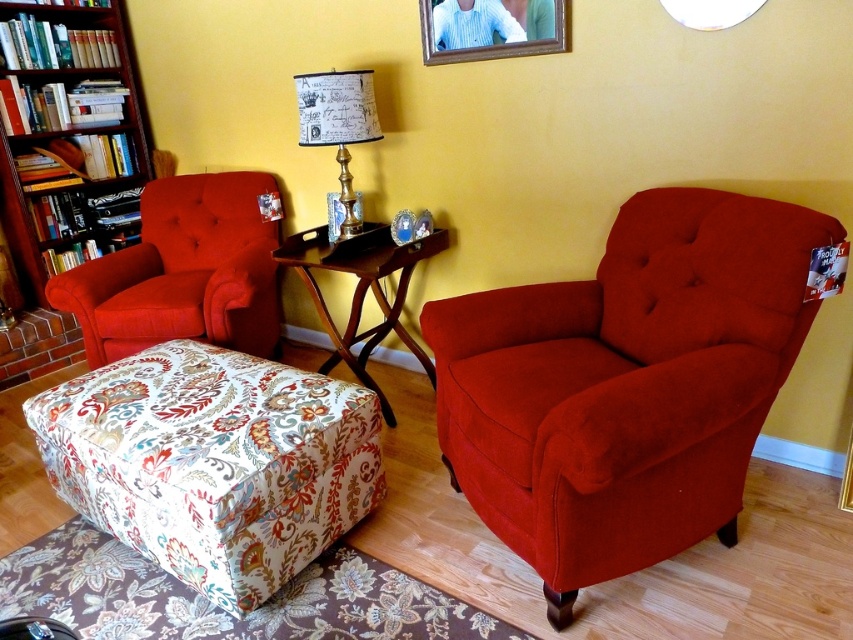
Between suede-like red armchair at right and wooden bookshelf at left, which one appears on the right side from the viewer's perspective?

suede-like red armchair at right is more to the right.

Who is positioned more to the left, suede-like red armchair at right or wooden bookshelf at left?

wooden bookshelf at left

Which is behind, point (451, 381) or point (32, 74)?

Positioned behind is point (32, 74).

I want to click on suede-like red armchair at right, so click(x=625, y=385).

Who is taller, wooden bookshelf at left or wooden tray table at center?

wooden bookshelf at left is taller.

Describe the element at coordinates (67, 132) in the screenshot. This screenshot has width=853, height=640. I see `wooden bookshelf at left` at that location.

The width and height of the screenshot is (853, 640). What are the coordinates of `wooden bookshelf at left` in the screenshot? It's located at (67, 132).

You are a GUI agent. You are given a task and a screenshot of the screen. Output one action in this format:
    pyautogui.click(x=<x>, y=<y>)
    Task: Click on the wooden bookshelf at left
    This screenshot has width=853, height=640.
    Given the screenshot: What is the action you would take?
    pyautogui.click(x=67, y=132)

Which is below, suede-like red armchair at right or wooden tray table at center?

suede-like red armchair at right

At what (x,y) coordinates should I click in order to perform the action: click on suede-like red armchair at right. Please return your answer as a coordinate pair (x, y). Looking at the image, I should click on (625, 385).